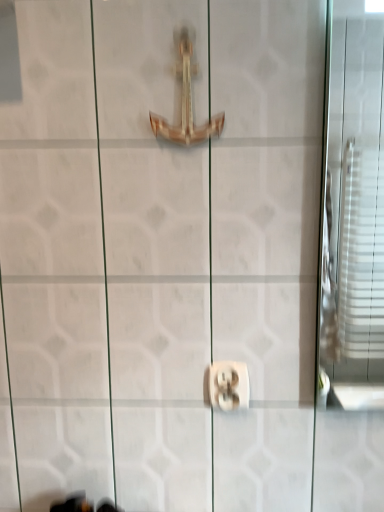
Looking at this image, measure the distance between point (237, 378) and camera.

Point (237, 378) and camera are 83.10 centimeters apart from each other.

Describe the element at coordinates (229, 385) in the screenshot. The height and width of the screenshot is (512, 384). I see `white matte knob at center` at that location.

This screenshot has height=512, width=384. Find the location of `white matte knob at center`. white matte knob at center is located at coordinates (229, 385).

Locate an element on the screen. white matte knob at center is located at coordinates (229, 385).